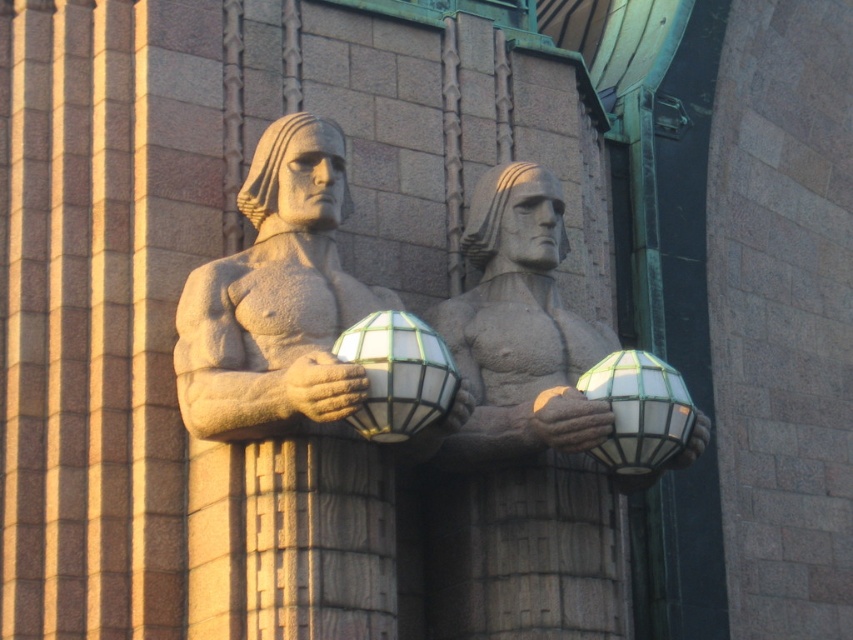
You are standing in front of two stone statues positioned side by side against a brick wall. You notice a point marked at coordinates (520, 337). Which statue does this point correspond to?

The point (520, 337) corresponds to the stone statue at center.

You are an art conservator tasked with measuring the spacing between two objects in the scene. You need to ensure that the distance between the stone statue at center and the translucent glass sphere at center is at least 12 feet to prevent damage from vibrations. Based on the provided information, is the current spacing sufficient?

The distance between the stone statue at center and the translucent glass sphere at center is 11.92 feet, which is slightly less than the required 12 feet. Therefore, the current spacing is insufficient to meet the safety requirement.